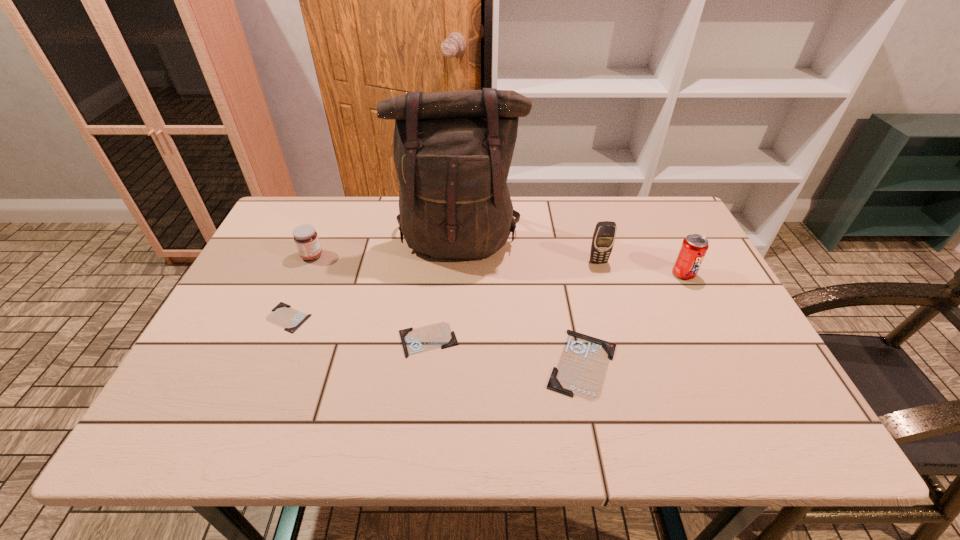
Find the location of a particular element. Image resolution: width=960 pixels, height=540 pixels. unoccupied area between the second identity card from left to right and the fifth shortest object is located at coordinates (556, 307).

This screenshot has height=540, width=960. What are the coordinates of `vacant space that is in between the cellular telephone and the shortest identity card` in the screenshot? It's located at (444, 289).

At what (x,y) coordinates should I click in order to perform the action: click on free space between the fifth shortest object and the fifth tallest object. Please return your answer as a coordinate pair (x, y). The height and width of the screenshot is (540, 960). Looking at the image, I should click on (633, 319).

Locate an element on the screen. vacant area that lies between the leftmost identity card and the second shortest identity card is located at coordinates (358, 328).

Identify the location of free space between the fifth tallest object and the jam. (447, 309).

Locate an element on the screen. vacant area between the tallest object and the cellular telephone is located at coordinates (528, 252).

Locate an element on the screen. The width and height of the screenshot is (960, 540). vacant space that's between the cellular telephone and the tallest object is located at coordinates (528, 252).

The width and height of the screenshot is (960, 540). I want to click on free area in between the third shortest object and the cellular telephone, so click(x=590, y=313).

Choose which object is the fourth nearest neighbor to the backpack. Please provide its 2D coordinates. Your answer should be formatted as a tuple, i.e. [(x, y)], where the tuple contains the x and y coordinates of a point satisfying the conditions above.

[(283, 315)]

This screenshot has width=960, height=540. Identify the location of object that is the fourth nearest to the fourth shortest object. (581, 370).